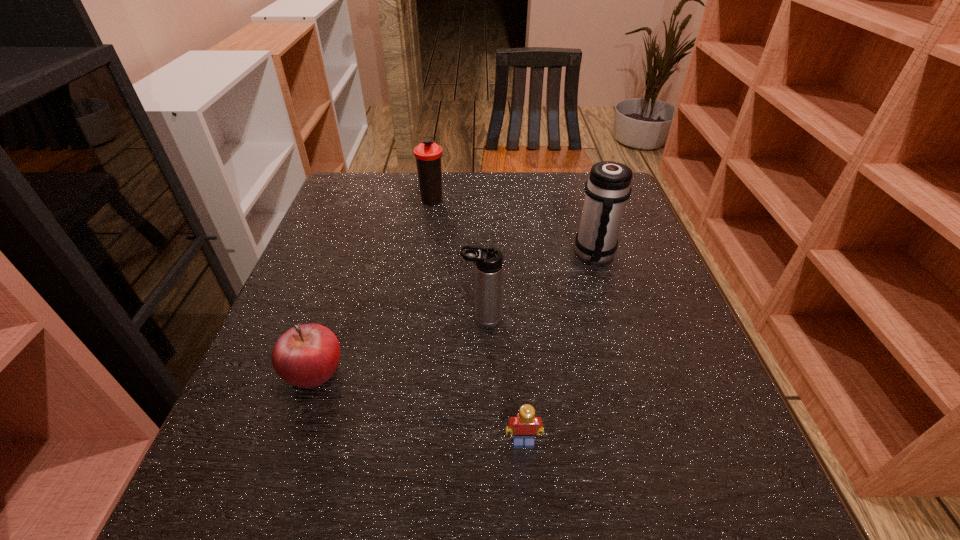
Identify the location of free space located 0.390m on the right of the farthest thermos bottle. The image size is (960, 540). (589, 200).

Locate an element on the screen. free space located 0.120m on the handle side of the second thermos bottle from right to left is located at coordinates (403, 320).

What are the coordinates of `vacant space situated on the handle side of the second thermos bottle from right to left` in the screenshot? It's located at (433, 320).

In order to click on free point located 0.300m on the handle side of the second thermos bottle from right to left in this screenshot , I will do `click(314, 320)`.

I want to click on vacant point located on the back of the leftmost object, so click(x=350, y=261).

Identify the location of vacant region located on the front-facing side of the Lego. This screenshot has height=540, width=960. (528, 495).

Where is `object located in the far edge section of the desktop`? object located in the far edge section of the desktop is located at coordinates (428, 154).

I want to click on object that is at the left edge, so tap(306, 356).

What are the coordinates of `object positioned at the right edge` in the screenshot? It's located at (608, 187).

The height and width of the screenshot is (540, 960). What are the coordinates of `vacant space at the far edge` in the screenshot? It's located at (475, 210).